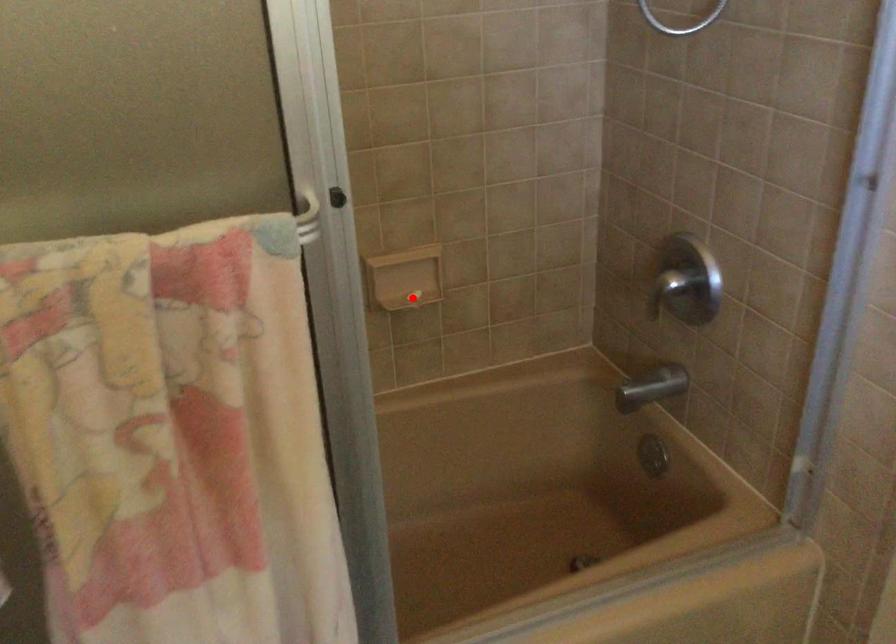
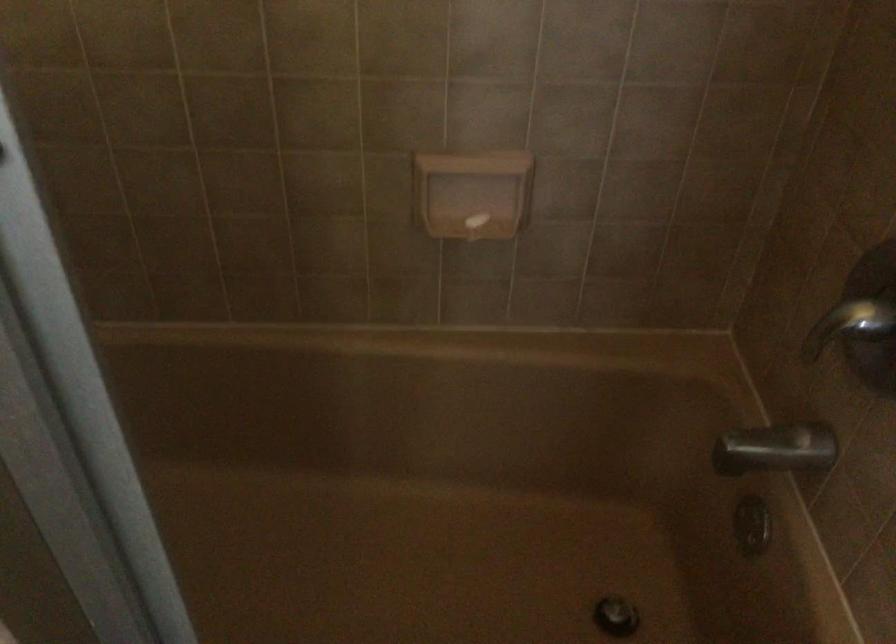
Where in the second image is the point corresponding to the highlighted location from the first image?

(476, 221)